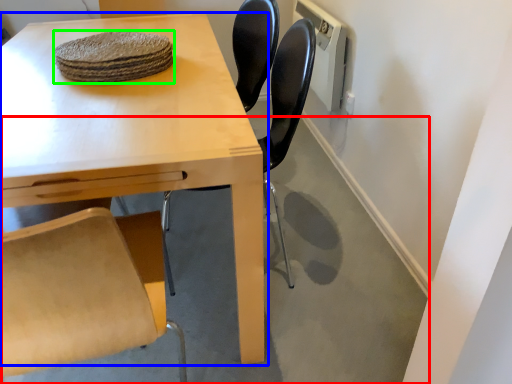
Question: Which object is the farthest from concrete (highlighted by a red box)? Choose among these: table (highlighted by a blue box) or food (highlighted by a green box).

Choices:
 (A) table
 (B) food

Answer: (B)